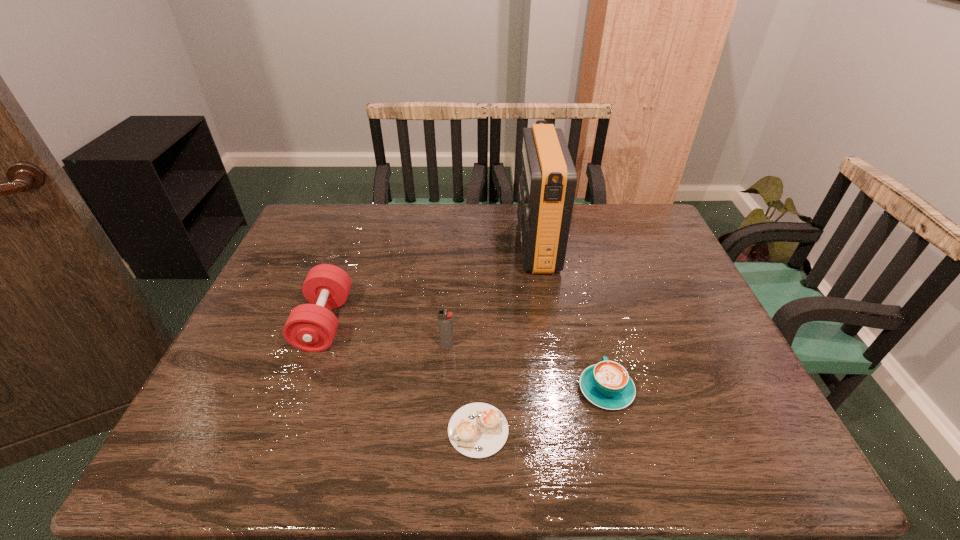
The image size is (960, 540). Identify the location of free space at the far edge. (456, 211).

You are a GUI agent. You are given a task and a screenshot of the screen. Output one action in this format:
    pyautogui.click(x=<x>, y=<y>)
    Task: Click on the free space at the near edge
    The image size is (960, 540).
    Given the screenshot: What is the action you would take?
    pyautogui.click(x=646, y=463)

I want to click on vacant region at the left edge of the desktop, so click(x=304, y=258).

The height and width of the screenshot is (540, 960). Identify the location of vacant area at the right edge of the desktop. (645, 248).

This screenshot has height=540, width=960. In order to click on vacant space at the far right corner of the desktop in this screenshot , I will do `click(665, 230)`.

Find the location of a particular element. Image resolution: width=960 pixels, height=540 pixels. vacant area that lies between the farthest object and the igniter is located at coordinates (492, 295).

The height and width of the screenshot is (540, 960). In order to click on empty space between the leftmost object and the radio receiver in this screenshot , I will do (431, 284).

Find the location of a particular element. vacant area that lies between the right cappuccino and the shortest object is located at coordinates (542, 410).

Identify the location of empty space between the igniter and the shortest object. This screenshot has height=540, width=960. (463, 388).

The height and width of the screenshot is (540, 960). What are the coordinates of `empty location between the second shortest object and the farthest object` in the screenshot? It's located at (571, 318).